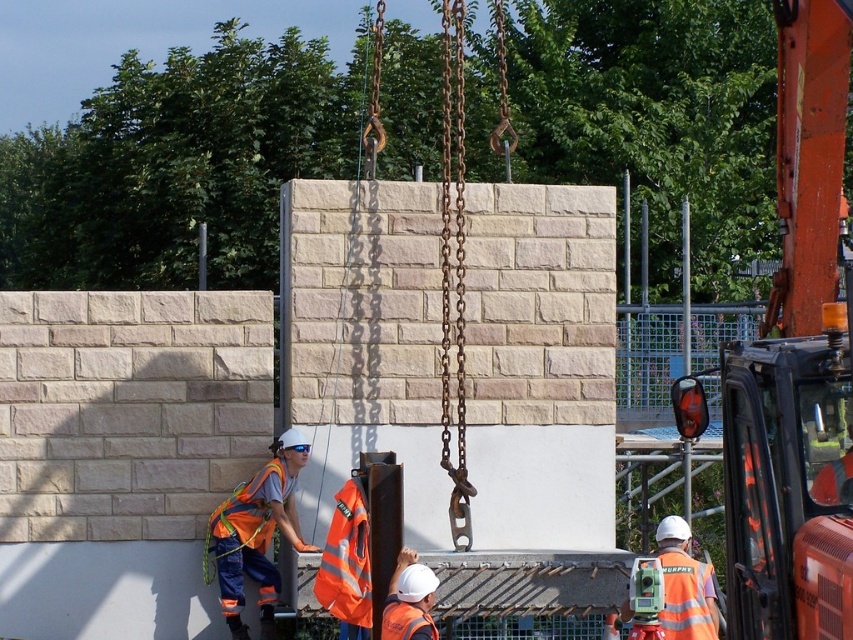
You are a safety inspector at the construction site. You notice a point at coordinate [683,586] in the image. What object is located at that point?

The point at coordinate [683,586] indicates a reflective orange vest at center.